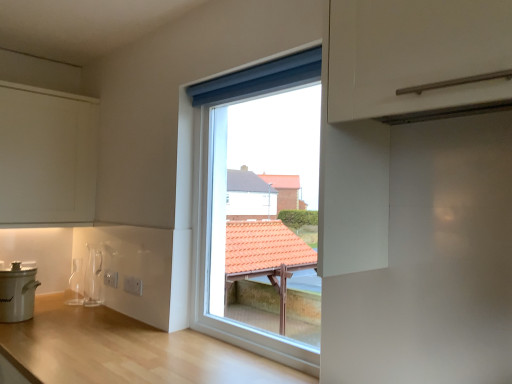
What is the approximate width of white matte cooker at lower left?

white matte cooker at lower left is 18.97 centimeters in width.

Measure the distance between white matte cabinet at upper left and camera.

white matte cabinet at upper left and camera are 7.37 feet apart from each other.

Locate an element on the screen. This screenshot has height=384, width=512. white matte cabinet at upper left is located at coordinates (47, 155).

Measure the distance between light wood countertop at center and camera.

The distance of light wood countertop at center from camera is 1.37 meters.

Identify the location of white matte cooker at lower left. Image resolution: width=512 pixels, height=384 pixels. (17, 293).

From the image's perspective, is white plastic window at center above white matte cabinet at upper left?

No, from the image's perspective, white plastic window at center is not over white matte cabinet at upper left.

Does white plastic window at center have a greater width compared to white matte cabinet at upper left?

Incorrect, the width of white plastic window at center does not surpass that of white matte cabinet at upper left.

Is white plastic window at center located outside white matte cabinet at upper left?

Yes, white plastic window at center is outside of white matte cabinet at upper left.

Find the location of `cabinetry on the left of the white plastic window at center`. cabinetry on the left of the white plastic window at center is located at coordinates (47, 155).

Is light wood countertop at center aimed at white matte cabinet at upper left?

No, light wood countertop at center is not oriented towards white matte cabinet at upper left.

Is light wood countertop at center beside white matte cabinet at upper left?

light wood countertop at center and white matte cabinet at upper left are not in contact.

Can white matte cabinet at upper left be found inside light wood countertop at center?

No, white matte cabinet at upper left is located outside of light wood countertop at center.

Is white matte cabinet at upper left touching white plastic window at center?

No, white matte cabinet at upper left is not touching white plastic window at center.

Is white matte cabinet at upper left outside of white plastic window at center?

Indeed, white matte cabinet at upper left is completely outside white plastic window at center.

Considering the relative sizes of white matte cabinet at upper left and white plastic window at center in the image provided, is white matte cabinet at upper left shorter than white plastic window at center?

Yes.

Is white matte cabinet at upper left further to camera compared to white plastic window at center?

Yes, white matte cabinet at upper left is further from the viewer.

In the scene shown: Is white matte cooker at lower left positioned with its back to white plastic window at center?

white matte cooker at lower left does not have its back to white plastic window at center.

Which is in front, point (19, 264) or point (289, 328)?

The point (289, 328) is closer to the camera.

From the image's perspective, which one is positioned lower, white matte cooker at lower left or white plastic window at center?

white matte cooker at lower left appears lower in the image.

Would you say white matte cabinet at upper left is a long distance from light wood countertop at center?

Result: Actually, white matte cabinet at upper left and light wood countertop at center are a little close together.

From a real-world perspective, is white matte cabinet at upper left above or below light wood countertop at center?

From a real-world perspective, white matte cabinet at upper left is physically above light wood countertop at center.

Find the location of a particular element. The height and width of the screenshot is (384, 512). cabinetry above the light wood countertop at center (from the image's perspective) is located at coordinates (47, 155).

Is white matte cabinet at upper left oriented towards light wood countertop at center?

No, white matte cabinet at upper left is not oriented towards light wood countertop at center.

Is white matte cooker at lower left far away from white matte cabinet at upper left?

white matte cooker at lower left is near white matte cabinet at upper left, not far away.

Consider the image. Based on their positions, is white matte cooker at lower left located to the left or right of white matte cabinet at upper left?

From the image, it's evident that white matte cooker at lower left is to the right of white matte cabinet at upper left.

Considering the positions of point (5, 278) and point (72, 177), is point (5, 278) closer or farther from the camera than point (72, 177)?

Point (5, 278) appears to be closer to the viewer than point (72, 177).

Is light wood countertop at center taller than white matte cooker at lower left?

Yes, light wood countertop at center is taller than white matte cooker at lower left.

Between light wood countertop at center and white matte cooker at lower left, which one is positioned behind?

white matte cooker at lower left is more distant.

Based on the photo, is light wood countertop at center inside or outside of white matte cooker at lower left?

light wood countertop at center is spatially situated outside white matte cooker at lower left.

This screenshot has width=512, height=384. In the image, there is a white matte cabinet at upper left. Identify the location of window below it (from the image's perspective). (255, 209).

Locate an element on the screen. cabinetry on the left of the light wood countertop at center is located at coordinates (47, 155).

Looking at the image, which one is located further to light wood countertop at center, white plastic window at center or white matte cooker at lower left?

The object further to light wood countertop at center is white plastic window at center.

Which object lies further to the anchor point white plastic window at center, light wood countertop at center or white matte cabinet at upper left?

The object further to white plastic window at center is white matte cabinet at upper left.

Consider the image. Estimate the real-world distances between objects in this image. Which object is further from light wood countertop at center, white matte cooker at lower left or white plastic window at center?

white plastic window at center is further to light wood countertop at center.

Based on their spatial positions, is white matte cooker at lower left or white plastic window at center closer to white matte cabinet at upper left?

The object closer to white matte cabinet at upper left is white matte cooker at lower left.

Looking at the image, which one is located further to white matte cooker at lower left, white plastic window at center or white matte cabinet at upper left?

white plastic window at center is positioned further to the anchor white matte cooker at lower left.

From the picture: Looking at the image, which one is located closer to light wood countertop at center, white matte cabinet at upper left or white plastic window at center?

The object closer to light wood countertop at center is white plastic window at center.

Considering their positions, is light wood countertop at center positioned further to white matte cooker at lower left than white plastic window at center?

white plastic window at center is positioned further to the anchor white matte cooker at lower left.

From the image, which object appears to be farther from white matte cooker at lower left, white matte cabinet at upper left or white plastic window at center?

Based on the image, white plastic window at center appears to be further to white matte cooker at lower left.

Where is `counter between white matte cooker at lower left and white plastic window at center from left to right`? The width and height of the screenshot is (512, 384). counter between white matte cooker at lower left and white plastic window at center from left to right is located at coordinates (127, 350).

Locate an element on the screen. cooker located between white matte cabinet at upper left and white plastic window at center in the left-right direction is located at coordinates (17, 293).

Locate an element on the screen. The width and height of the screenshot is (512, 384). cooker between light wood countertop at center and white matte cabinet at upper left from front to back is located at coordinates (17, 293).

Image resolution: width=512 pixels, height=384 pixels. Identify the location of counter situated between white matte cabinet at upper left and white plastic window at center from left to right. (127, 350).